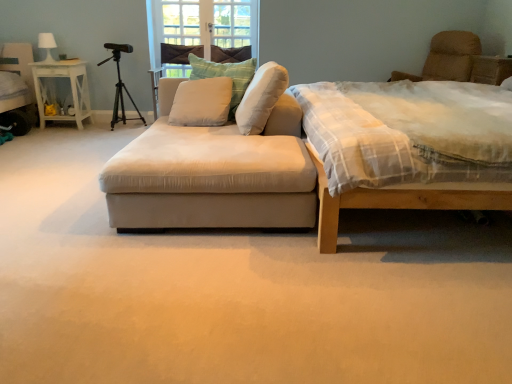
Where is `free region on the left part of beige fabric studio couch at center`? This screenshot has width=512, height=384. free region on the left part of beige fabric studio couch at center is located at coordinates (57, 184).